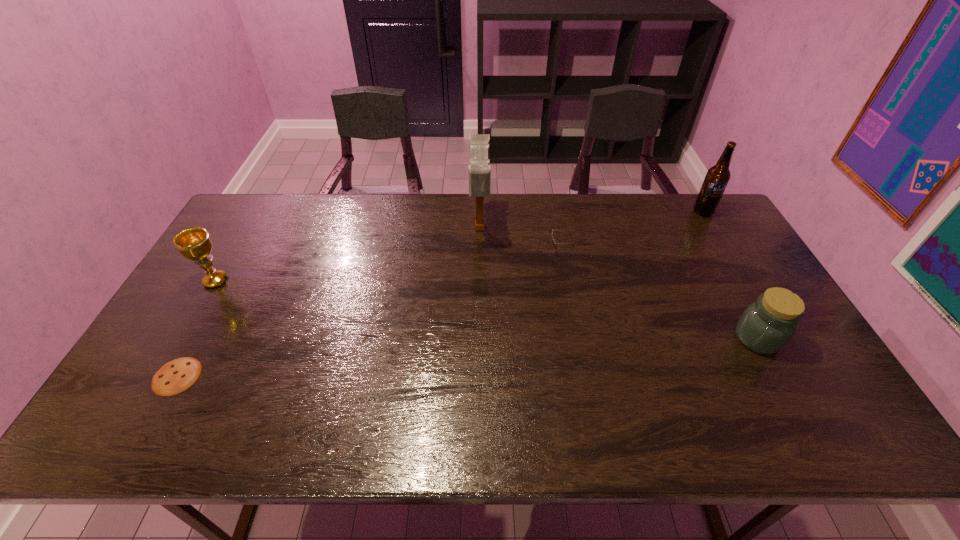
You are a GUI agent. You are given a task and a screenshot of the screen. Output one action in this format:
    pyautogui.click(x=<x>, y=<y>)
    Task: Click on the third object from left to right
    The height and width of the screenshot is (540, 960).
    Given the screenshot: What is the action you would take?
    pyautogui.click(x=479, y=169)

What are the coordinates of `beer bottle` in the screenshot? It's located at (717, 177).

Locate an element on the screen. The height and width of the screenshot is (540, 960). the third nearest object is located at coordinates click(194, 243).

Identify the location of the second nearest object. (766, 326).

You are a GUI agent. You are given a task and a screenshot of the screen. Output one action in this format:
    pyautogui.click(x=<x>, y=<y>)
    Task: Click on the second shortest object
    The height and width of the screenshot is (540, 960).
    Given the screenshot: What is the action you would take?
    pyautogui.click(x=553, y=242)

Where is `sunglasses`? The height and width of the screenshot is (540, 960). sunglasses is located at coordinates (553, 242).

At what (x,y) coordinates should I click in order to perform the action: click on cookie. Please return your answer as a coordinate pair (x, y). This screenshot has width=960, height=540. Looking at the image, I should click on (176, 376).

Identify the location of the shortest object. (176, 376).

I want to click on blank space located 0.260m on the front of the third object from left to right, so click(480, 310).

Locate an element on the screen. The height and width of the screenshot is (540, 960). vacant space located on the label of the beer bottle is located at coordinates (719, 240).